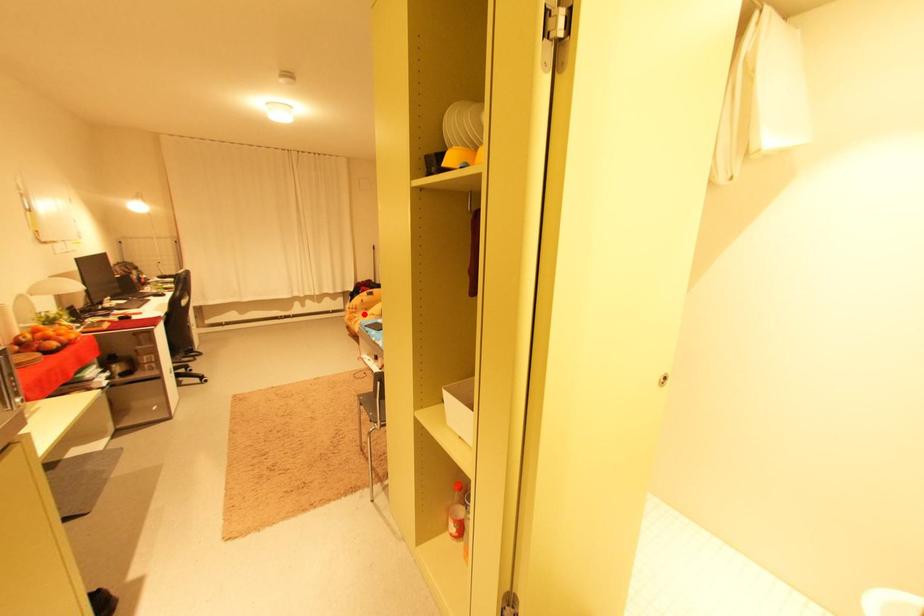
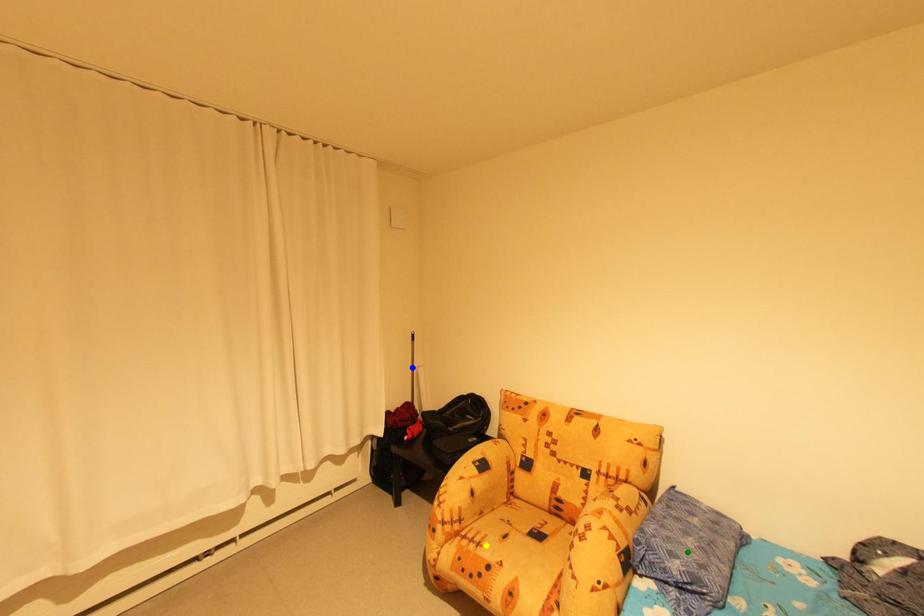
Question: I am providing you with two images of the same scene from different viewpoints. A red point is marked on the first image. You are given multiple points on the second image. Which mark in image 2 goes with the point in image 1?

Choices:
 (A) blue point
 (B) yellow point
 (C) green point

Answer: (B)